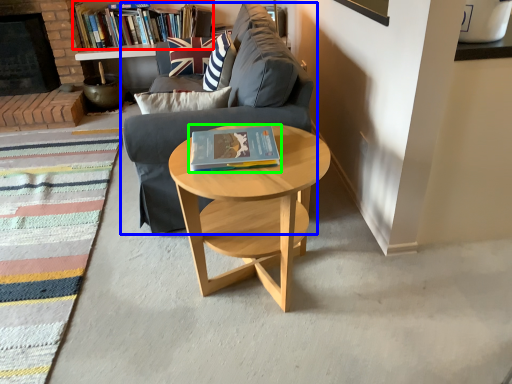
Question: Which object is positioned farthest from book (highlighted by a red box)? Select from studio couch (highlighted by a blue box) and book (highlighted by a green box).

Choices:
 (A) studio couch
 (B) book

Answer: (B)